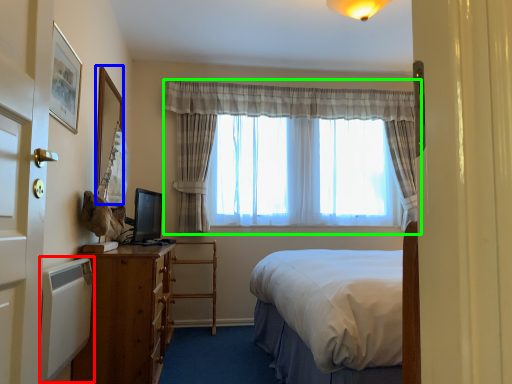
Question: Which is nearer to the radiator (highlighted by a red box)? picture frame (highlighted by a blue box) or curtain (highlighted by a green box).

Choices:
 (A) picture frame
 (B) curtain

Answer: (A)